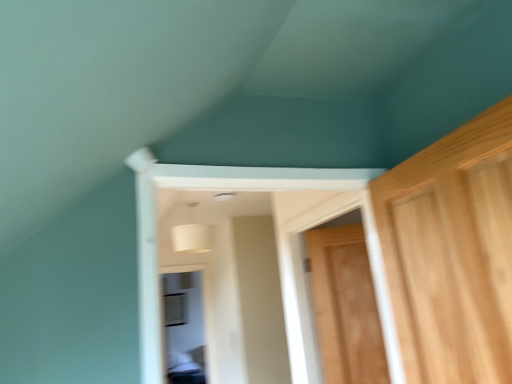
Question: Looking at their shapes, would you say wooden door at right is wider or thinner than transparent glass window at center?

Choices:
 (A) wide
 (B) thin

Answer: (B)

Question: Based on their positions, is wooden door at right located to the left or right of transparent glass window at center?

Choices:
 (A) left
 (B) right

Answer: (B)

Question: Is wooden door at right situated inside transparent glass window at center or outside?

Choices:
 (A) inside
 (B) outside

Answer: (B)

Question: Looking at the image, does transparent glass window at center seem bigger or smaller compared to wooden door at right?

Choices:
 (A) big
 (B) small

Answer: (A)

Question: Considering their positions, is transparent glass window at center located in front of or behind wooden door at right?

Choices:
 (A) behind
 (B) front

Answer: (A)

Question: From a real-world perspective, is transparent glass window at center above or below wooden door at right?

Choices:
 (A) above
 (B) below

Answer: (B)

Question: In terms of height, does transparent glass window at center look taller or shorter compared to wooden door at right?

Choices:
 (A) short
 (B) tall

Answer: (B)